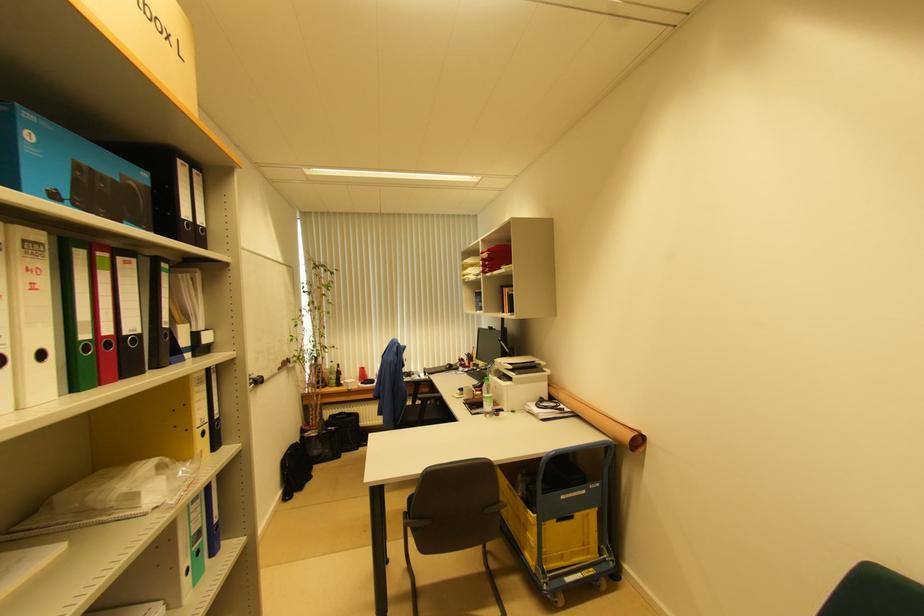
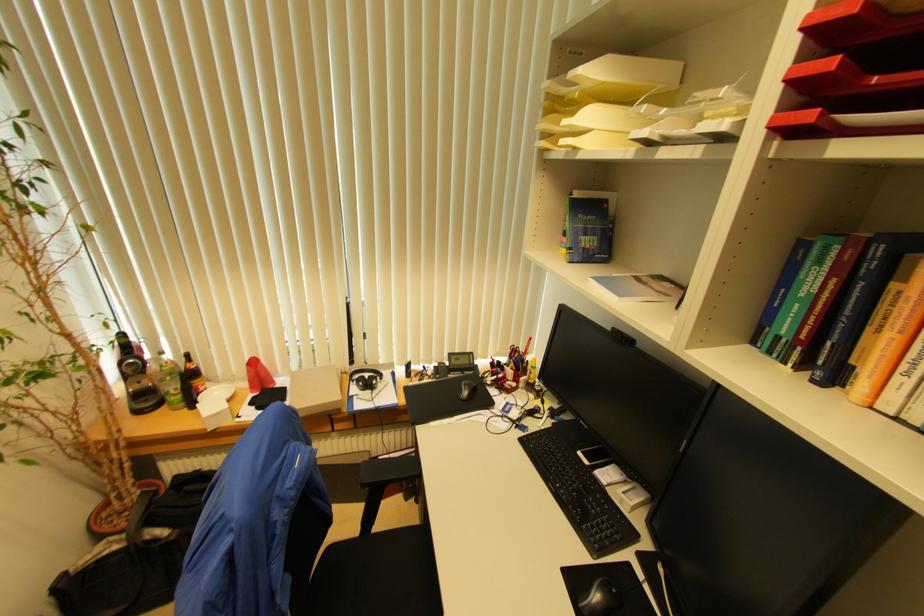
Question: What movement of the cameraman would produce the second image?

Choices:
 (A) Left
 (B) Right
 (C) Forward
 (D) Backward

Answer: (C)